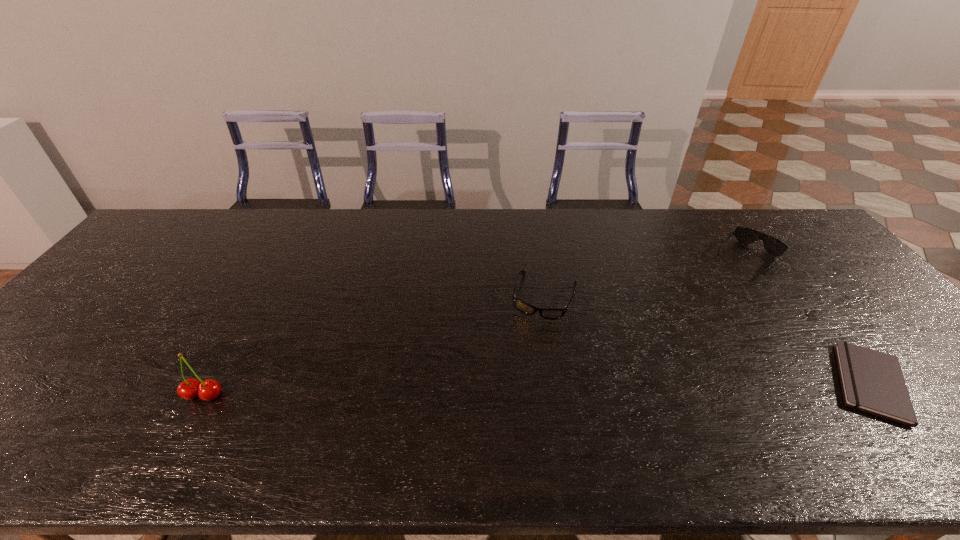
This screenshot has height=540, width=960. What are the coordinates of `free spot between the checkbook and the sunglasses` in the screenshot? It's located at (809, 321).

Identify the location of vacant region between the second object from left to right and the sunglasses. The height and width of the screenshot is (540, 960). (646, 278).

You are a GUI agent. You are given a task and a screenshot of the screen. Output one action in this format:
    pyautogui.click(x=<x>, y=<y>)
    Task: Click on the empty space that is in between the cherry and the sunglasses
    The width and height of the screenshot is (960, 540).
    Given the screenshot: What is the action you would take?
    pyautogui.click(x=475, y=327)

What are the coordinates of `object that is the closest to the checkbook` in the screenshot? It's located at (772, 245).

Identify which object is located as the nearest to the sunglasses. Please provide its 2D coordinates. Your answer should be formatted as a tuple, i.e. [(x, y)], where the tuple contains the x and y coordinates of a point satisfying the conditions above.

[(871, 381)]

Where is `free space that satisfies the following two spatial constraints: 1. on the front side of the checkbook; 2. on the right side of the second object from left to right`? free space that satisfies the following two spatial constraints: 1. on the front side of the checkbook; 2. on the right side of the second object from left to right is located at coordinates (558, 383).